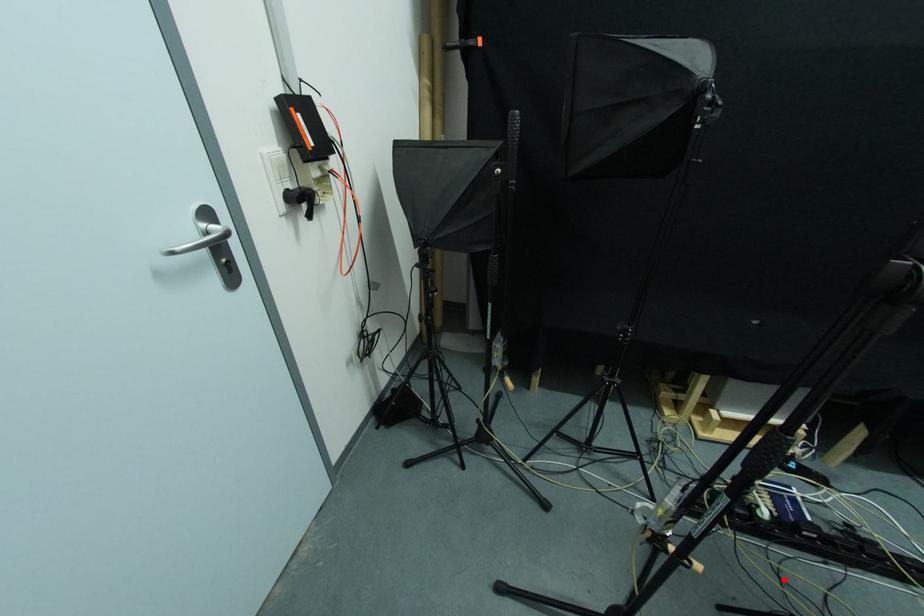
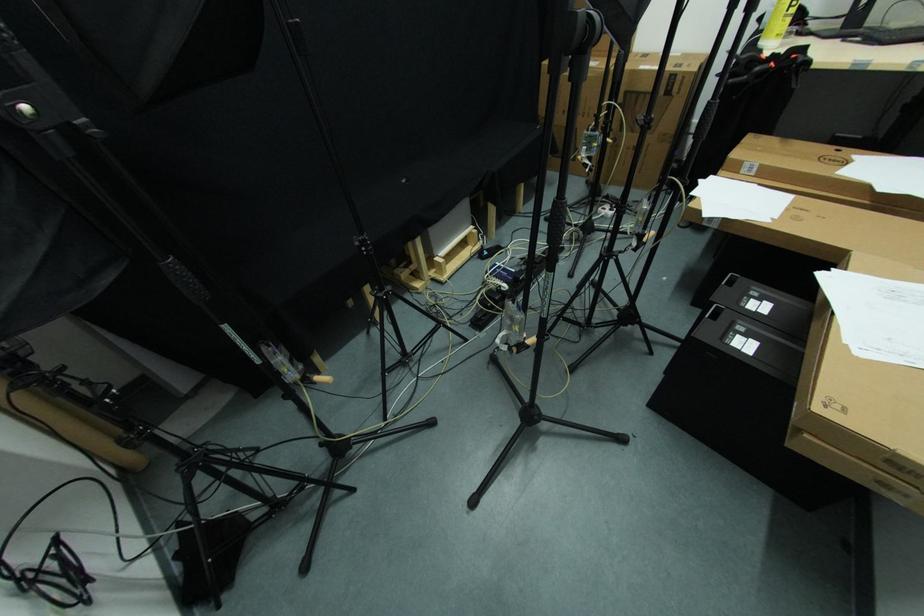
Where in the second image is the point corresponding to the highlighted location from the first image?

(535, 310)